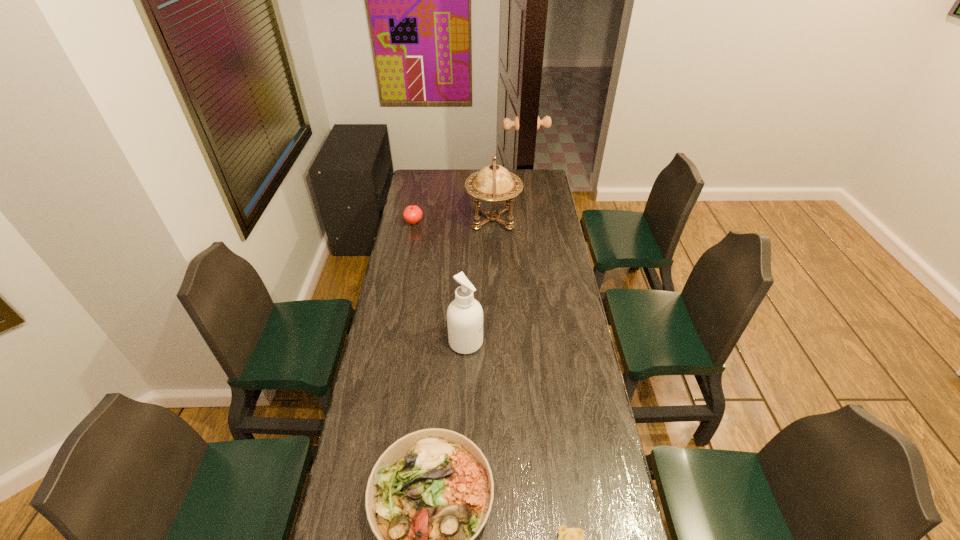
This screenshot has height=540, width=960. In order to click on globe in this screenshot , I will do `click(493, 184)`.

You are a GUI agent. You are given a task and a screenshot of the screen. Output one action in this format:
    pyautogui.click(x=<x>, y=<y>)
    Task: Click on the third nearest object
    Image resolution: width=960 pixels, height=540 pixels.
    Given the screenshot: What is the action you would take?
    pyautogui.click(x=464, y=315)

Where is `apple`? The height and width of the screenshot is (540, 960). apple is located at coordinates (413, 214).

This screenshot has height=540, width=960. What are the coordinates of `vacant space situated 0.200m on the front-facing side of the globe` in the screenshot? It's located at (427, 219).

Identify the location of vacant space located 0.290m on the front-facing side of the globe. The height and width of the screenshot is (540, 960). (411, 219).

The height and width of the screenshot is (540, 960). Identify the location of vacant space located on the front-facing side of the globe. (417, 219).

Where is `vacant space located on the front label of the cleansing agent`? This screenshot has height=540, width=960. vacant space located on the front label of the cleansing agent is located at coordinates (519, 342).

This screenshot has width=960, height=540. In order to click on vacant region located 0.140m on the back of the apple in this screenshot , I will do `click(418, 202)`.

Where is `object that is at the left edge`? The width and height of the screenshot is (960, 540). object that is at the left edge is located at coordinates (413, 214).

Locate an element on the screen. This screenshot has height=540, width=960. free space at the left edge is located at coordinates (383, 338).